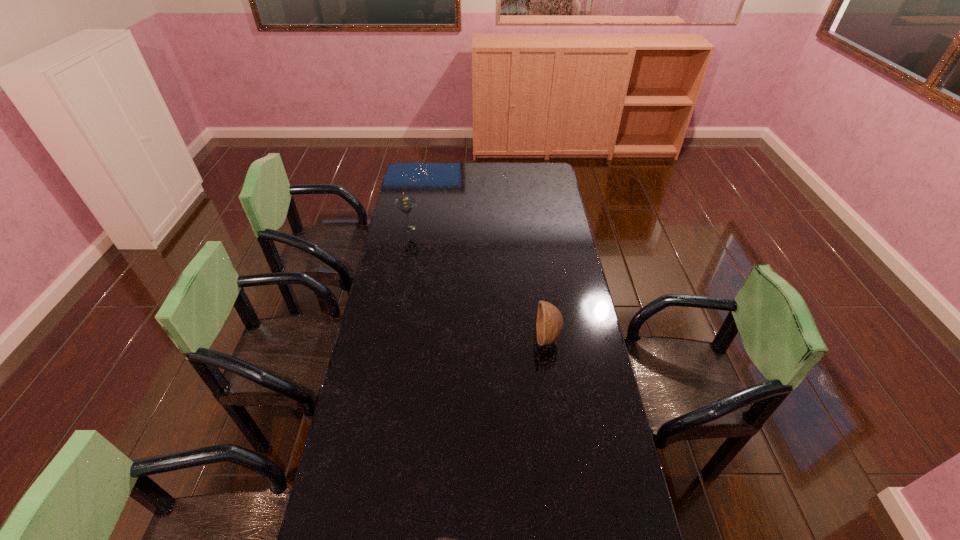
Find the location of `vacant space at the right edge of the desktop`. vacant space at the right edge of the desktop is located at coordinates (598, 453).

Locate an element on the screen. free space between the second farthest object and the leftmost object is located at coordinates (478, 283).

Identify the location of vacant area that lies between the martini and the rightmost object. This screenshot has width=960, height=540. (478, 283).

Find the location of a particular element. This screenshot has width=960, height=540. free spot between the second nearest object and the farthest object is located at coordinates (478, 283).

Where is `vacant space in between the leftmost object and the second nearest object`? This screenshot has width=960, height=540. vacant space in between the leftmost object and the second nearest object is located at coordinates (478, 283).

I want to click on object that is the closest to the second object from left to right, so click(549, 326).

Select which object appears as the closest to the farthest object. Please provide its 2D coordinates. Your answer should be formatted as a tuple, i.e. [(x, y)], where the tuple contains the x and y coordinates of a point satisfying the conditions above.

[(549, 326)]

This screenshot has height=540, width=960. In order to click on blank area in the image that satisfies the following two spatial constraints: 1. on the front side of the bowl; 2. on the left side of the leftmost object in this screenshot , I will do `click(388, 338)`.